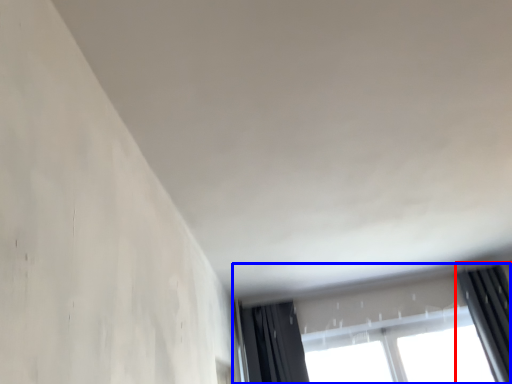
Question: Which object appears farthest to the camera in this image, curtain (highlighted by a red box) or window (highlighted by a blue box)?

Choices:
 (A) curtain
 (B) window

Answer: (B)